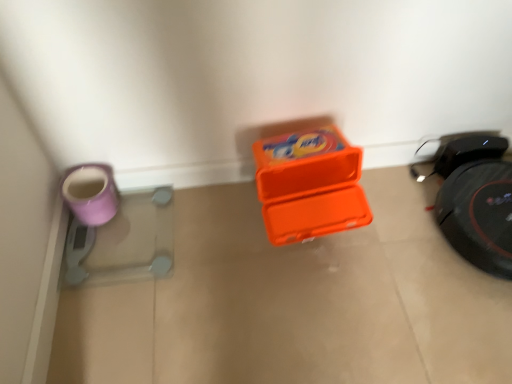
Find the location of a particular element. unoccupied region to the right of matte purple mug at left is located at coordinates (144, 223).